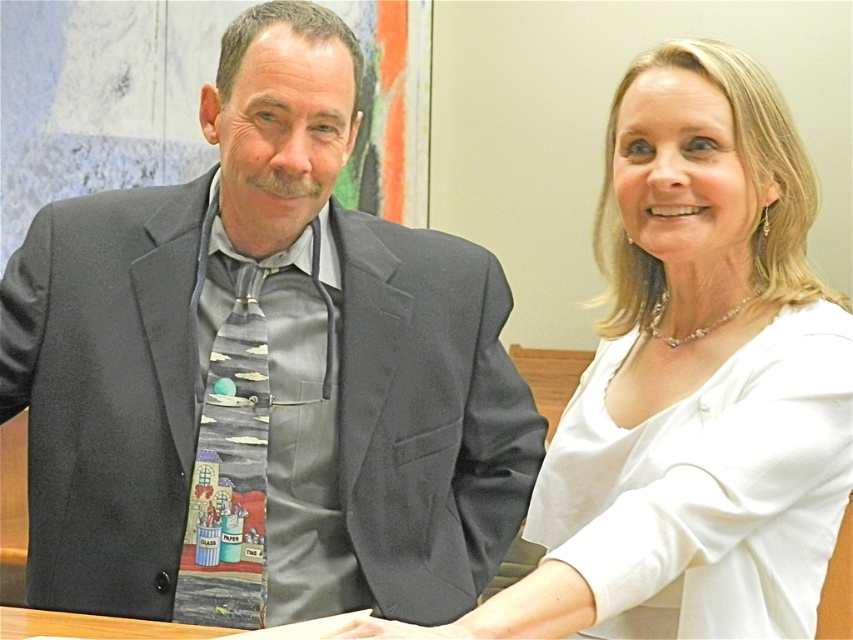
Does matte gray suit at left lie in front of wooden table at lower center?

No, it is behind wooden table at lower center.

Does point (142, 566) come in front of point (32, 616)?

That is False.

Image resolution: width=853 pixels, height=640 pixels. Find the location of `matte gray suit at left`. matte gray suit at left is located at coordinates (265, 365).

Locate an element on the screen. matte gray suit at left is located at coordinates (265, 365).

How much distance is there between matte gray suit at left and white satin blouse at center?

matte gray suit at left is 15.20 inches away from white satin blouse at center.

The height and width of the screenshot is (640, 853). Find the location of `matte gray suit at left`. matte gray suit at left is located at coordinates tap(265, 365).

Based on the photo, does white satin blouse at center have a greater height compared to wooden table at lower center?

Yes, white satin blouse at center is taller than wooden table at lower center.

Image resolution: width=853 pixels, height=640 pixels. Find the location of `white satin blouse at center`. white satin blouse at center is located at coordinates (691, 384).

The height and width of the screenshot is (640, 853). In order to click on white satin blouse at center in this screenshot , I will do `click(691, 384)`.